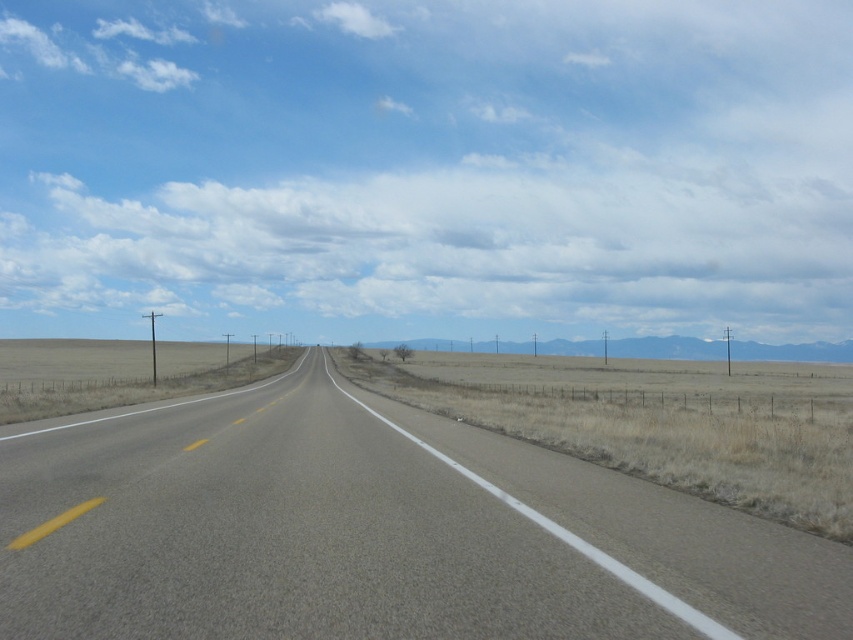
Can you confirm if asphalt road at center is positioned to the right of dry grass at center?

Incorrect, asphalt road at center is not on the right side of dry grass at center.

Can you confirm if asphalt road at center is smaller than dry grass at center?

Indeed, asphalt road at center has a smaller size compared to dry grass at center.

This screenshot has height=640, width=853. What do you see at coordinates (373, 532) in the screenshot?
I see `asphalt road at center` at bounding box center [373, 532].

Identify the location of asphalt road at center. The image size is (853, 640). (373, 532).